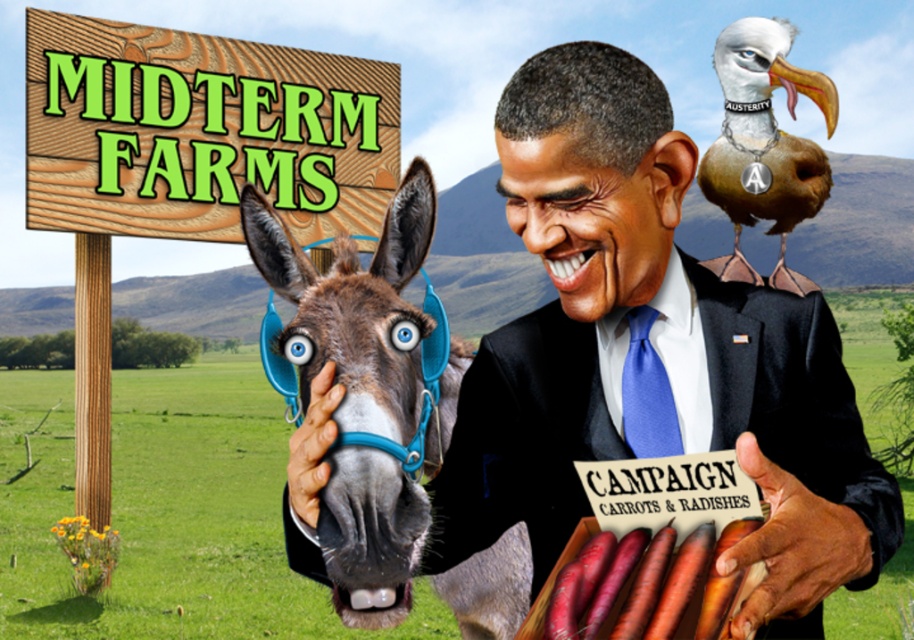
Does wooden signboard at upper left lie behind black satin business suit at center?

Yes, it is.

Which of these two, wooden signboard at upper left or black satin business suit at center, stands taller?

wooden signboard at upper left

Which is behind, point (105, 182) or point (849, 392)?

The point (105, 182) is behind.

Locate an element on the screen. Image resolution: width=914 pixels, height=640 pixels. wooden signboard at upper left is located at coordinates (200, 131).

Looking at this image, can you confirm if brown leather donkey at left is bigger than deep orange carrot at lower center?

Yes.

Is brown leather donkey at left to the left of deep orange carrot at lower center from the viewer's perspective?

Correct, you'll find brown leather donkey at left to the left of deep orange carrot at lower center.

Does point (296, 348) come farther from viewer compared to point (670, 563)?

Yes, it is.

Find the location of `brown leather donkey at left`. brown leather donkey at left is located at coordinates (355, 307).

Does wooden signboard at upper left appear over brown feathered bird at upper right?

Yes.

Is wooden signboard at upper left taller than brown feathered bird at upper right?

No, wooden signboard at upper left is not taller than brown feathered bird at upper right.

Image resolution: width=914 pixels, height=640 pixels. Identify the location of wooden signboard at upper left. (200, 131).